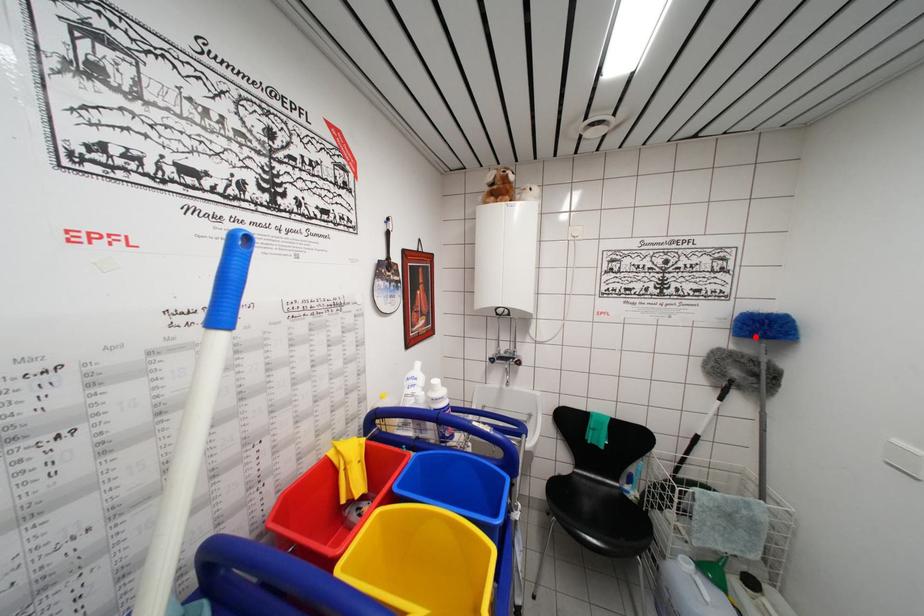
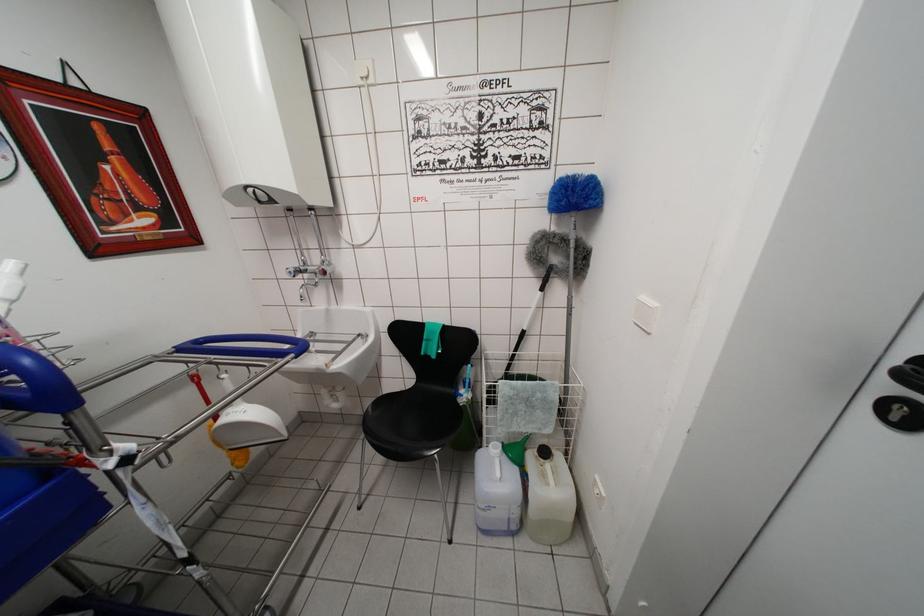
Where in the second image is the point corresponding to the highlighted location from the first image?

(562, 206)